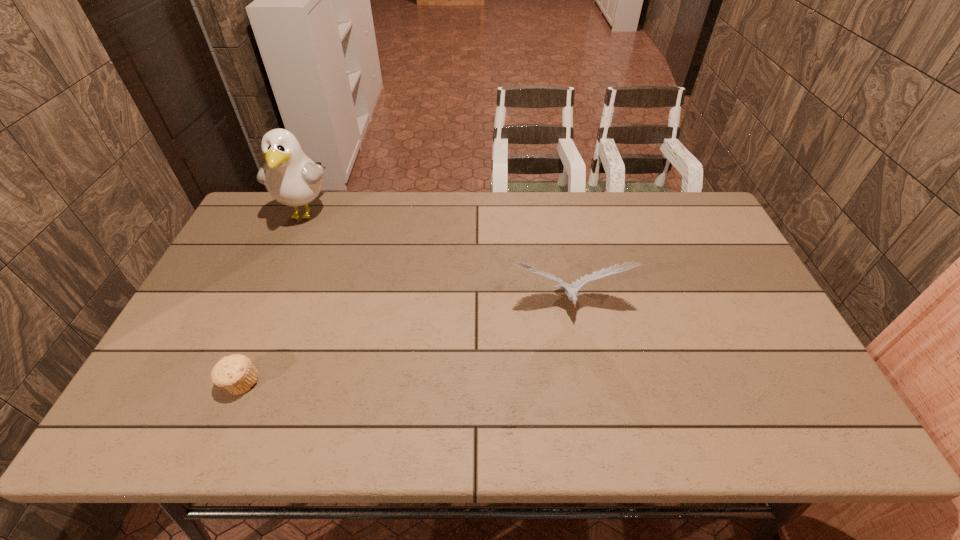
Identify the location of the farther gull. The height and width of the screenshot is (540, 960). (292, 178).

This screenshot has height=540, width=960. In order to click on the taller gull in this screenshot , I will do `click(292, 178)`.

Identify the location of the second tallest object. (571, 290).

Locate an element on the screen. This screenshot has height=540, width=960. the rightmost object is located at coordinates (571, 290).

Where is `the shortest object`? Image resolution: width=960 pixels, height=540 pixels. the shortest object is located at coordinates (236, 373).

Locate an element on the screen. muffin is located at coordinates (236, 373).

Where is `blank area located 0.110m on the beak of the taller gull`? blank area located 0.110m on the beak of the taller gull is located at coordinates (284, 261).

Find the location of a particular element. The height and width of the screenshot is (540, 960). free space located at the tip of the beak of the right gull is located at coordinates (592, 437).

The image size is (960, 540). Identify the location of free spot located 0.120m on the right of the shortest object. (309, 383).

You are a GUI agent. You are given a task and a screenshot of the screen. Output one action in this format:
    pyautogui.click(x=<x>, y=<y>)
    Task: Click on the object that is at the far edge
    This screenshot has height=540, width=960.
    Given the screenshot: What is the action you would take?
    pyautogui.click(x=292, y=178)